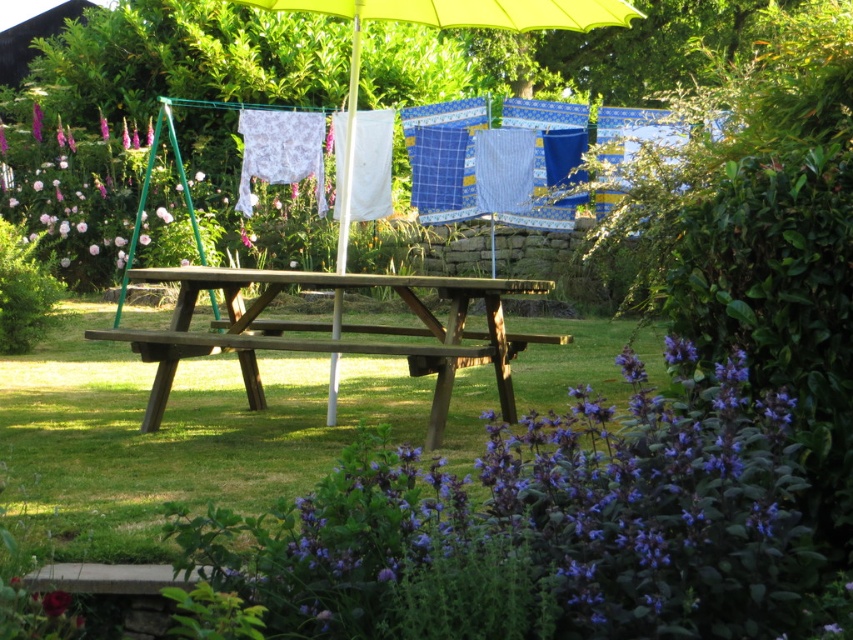
Is yellow fabric umbrella at center taller than purple matte flower at lower left?

Correct, yellow fabric umbrella at center is much taller as purple matte flower at lower left.

Does yellow fabric umbrella at center lie in front of purple matte flower at lower left?

Yes, yellow fabric umbrella at center is in front of purple matte flower at lower left.

Which is in front, point (599, 19) or point (32, 132)?

Point (599, 19) is in front.

Locate an element on the screen. This screenshot has width=853, height=640. yellow fabric umbrella at center is located at coordinates (457, 20).

Which is more to the right, yellow fabric umbrella at center or purple matte flower at lower center?

Positioned to the right is yellow fabric umbrella at center.

Who is lower down, yellow fabric umbrella at center or purple matte flower at lower center?

Positioned lower is purple matte flower at lower center.

The width and height of the screenshot is (853, 640). Describe the element at coordinates (457, 20) in the screenshot. I see `yellow fabric umbrella at center` at that location.

At what (x,y) coordinates should I click in order to perform the action: click on yellow fabric umbrella at center. Please return your answer as a coordinate pair (x, y). Looking at the image, I should click on pyautogui.click(x=457, y=20).

Describe the element at coordinates (334, 332) in the screenshot. I see `wooden picnic table at center` at that location.

Between wooden picnic table at center and purple matte flower at lower center, which one is positioned higher?

wooden picnic table at center is above.

What do you see at coordinates (334, 332) in the screenshot?
I see `wooden picnic table at center` at bounding box center [334, 332].

The height and width of the screenshot is (640, 853). What are the coordinates of `wooden picnic table at center` in the screenshot? It's located at (334, 332).